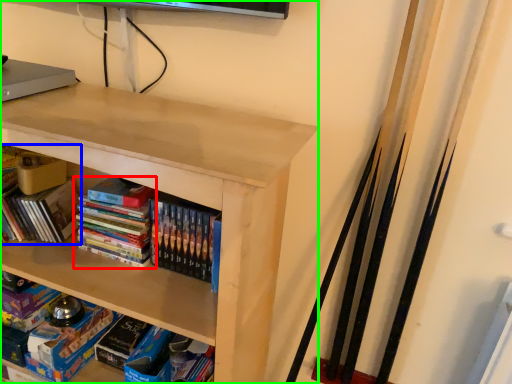
Question: Based on their relative distances, which object is nearer to book (highlighted by a red box)? Choose from book (highlighted by a blue box) and shelf (highlighted by a green box).

Choices:
 (A) book
 (B) shelf

Answer: (A)